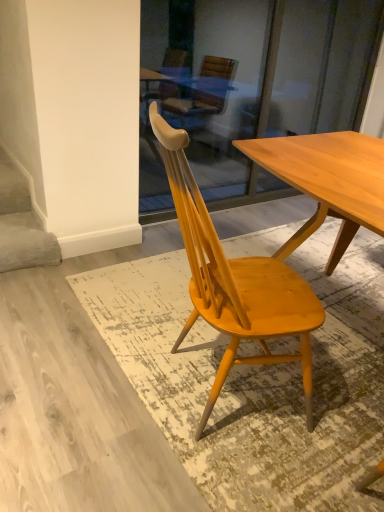
Question: Is white matte stairwell at lower left situated inside light brown wood chair at center or outside?

Choices:
 (A) inside
 (B) outside

Answer: (B)

Question: In terms of width, does white matte stairwell at lower left look wider or thinner when compared to light brown wood chair at center?

Choices:
 (A) thin
 (B) wide

Answer: (A)

Question: Is white matte stairwell at lower left taller or shorter than light brown wood chair at center?

Choices:
 (A) tall
 (B) short

Answer: (B)

Question: In the image, is light brown wood chair at center on the left side or the right side of white matte stairwell at lower left?

Choices:
 (A) left
 (B) right

Answer: (B)

Question: Is light brown wood chair at center inside the boundaries of white matte stairwell at lower left, or outside?

Choices:
 (A) inside
 (B) outside

Answer: (B)

Question: Considering the positions of light brown wood chair at center and white matte stairwell at lower left in the image, is light brown wood chair at center wider or thinner than white matte stairwell at lower left?

Choices:
 (A) thin
 (B) wide

Answer: (B)

Question: From a real-world perspective, is light brown wood chair at center above or below white matte stairwell at lower left?

Choices:
 (A) above
 (B) below

Answer: (A)